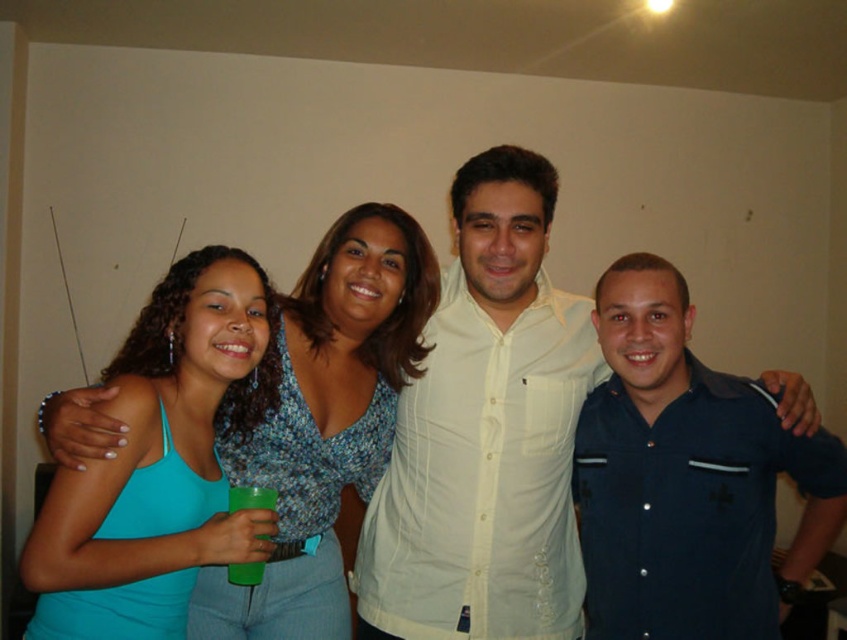
Question: Which of the following is the farthest from the observer?

Choices:
 (A) teal fabric tank top at left
 (B) dark blue shirt at center
 (C) white button-up shirt at center

Answer: (A)

Question: Is teal fabric tank top at left to the left of green plastic cup at center from the viewer's perspective?

Choices:
 (A) yes
 (B) no

Answer: (B)

Question: Which point is farther to the camera?

Choices:
 (A) (261, 561)
 (B) (396, 570)
 (C) (84, 445)

Answer: (B)

Question: Can you confirm if teal fabric tank top at left is positioned below green plastic cup at center?

Choices:
 (A) no
 (B) yes

Answer: (A)

Question: Among these objects, which one is farthest from the camera?

Choices:
 (A) dark blue shirt at center
 (B) white button-up shirt at center
 (C) teal fabric tank top at left
 (D) green plastic cup at center

Answer: (C)

Question: Does dark blue shirt at center have a greater width compared to teal fabric tank top at left?

Choices:
 (A) no
 (B) yes

Answer: (A)